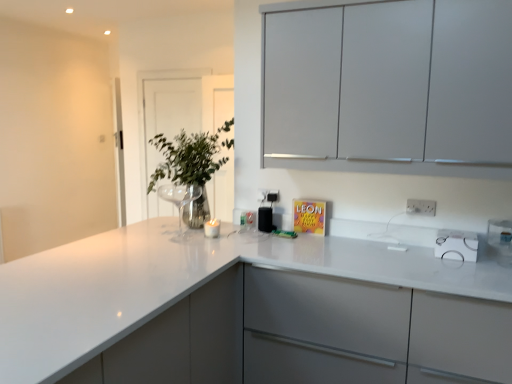
Question: From the image's perspective, is clear glass vase at upper left above or below white glossy countertop at center?

Choices:
 (A) above
 (B) below

Answer: (A)

Question: Choose the correct answer: Is clear glass vase at upper left inside white glossy countertop at center or outside it?

Choices:
 (A) inside
 (B) outside

Answer: (B)

Question: Which of these objects is positioned farthest from the black plastic speaker at center?

Choices:
 (A) white glossy countertop at center
 (B) transparent glass door at upper center
 (C) metallic glass vase at center
 (D) white plastic electric outlet at upper right, which is the 2th electric outlet in back-to-front order
 (E) silver metallic electric outlet at center, marked as the second electric outlet in a right-to-left arrangement

Answer: (B)

Question: Estimate the real-world distances between objects in this image. Which object is farther from the transparent glass door at upper center?

Choices:
 (A) white plastic electric outlet at upper right, positioned as the 2th electric outlet in left-to-right order
 (B) white glossy countertop at center
 (C) clear glass vase at upper left
 (D) metallic glass vase at center
 (E) black plastic speaker at center

Answer: (A)